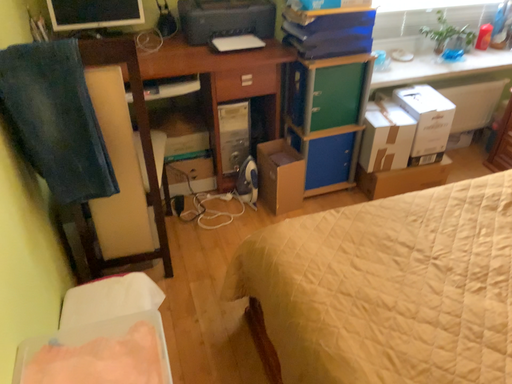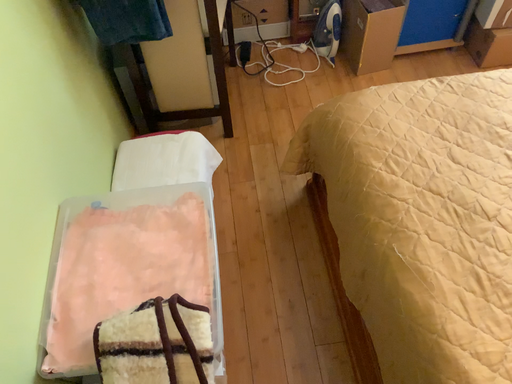
Question: Which way did the camera rotate in the video?

Choices:
 (A) rotated downward
 (B) rotated upward

Answer: (A)